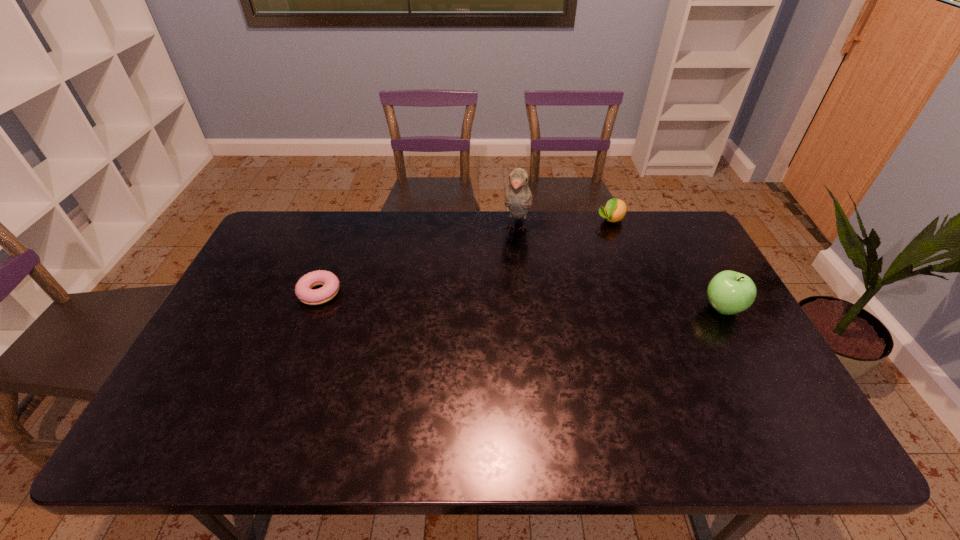
Where is `vacant space on the desktop that is between the shortest object and the third shortest object and is positioned at the face of the second object from left to right`? vacant space on the desktop that is between the shortest object and the third shortest object and is positioned at the face of the second object from left to right is located at coordinates (499, 300).

In order to click on vacant spot on the desktop that is between the leftmost object and the apple and is positioned with leaves positioned above the third tallest object in this screenshot , I will do `click(551, 301)`.